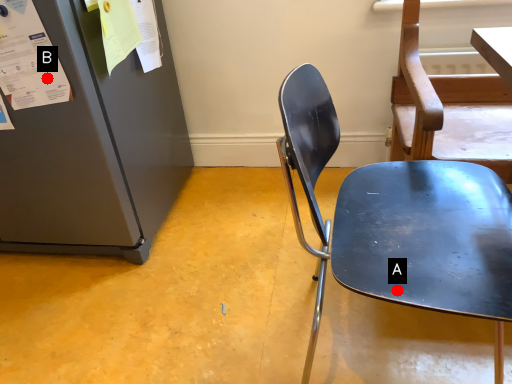
Question: Two points are circled on the image, labeled by A and B beside each circle. Among these points, which one is farthest from the camera?

Choices:
 (A) A is further
 (B) B is further

Answer: (B)